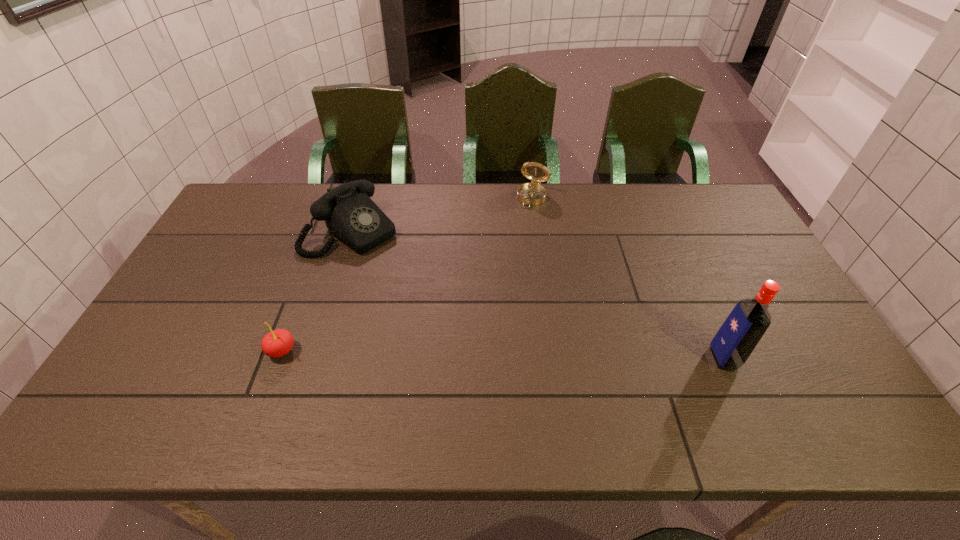
The height and width of the screenshot is (540, 960). I want to click on free spot that satisfies the following two spatial constraints: 1. on the back side of the cherry; 2. on the right side of the compass, so click(x=339, y=198).